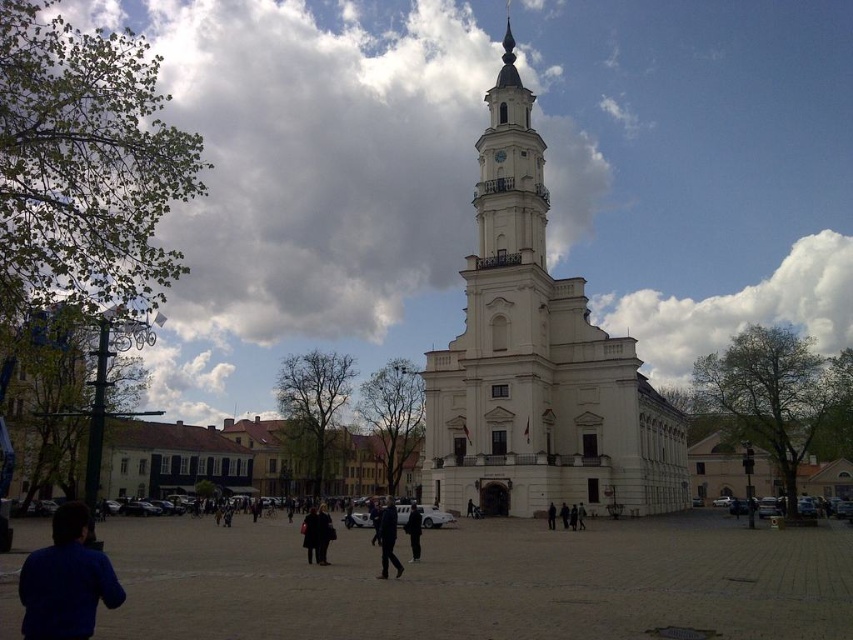
Question: Which point is closer to the camera?

Choices:
 (A) click(73, 602)
 (B) click(415, 560)
 (C) click(321, 516)
 (D) click(312, 544)

Answer: (A)

Question: Which is farther from the white stone clock tower at center?

Choices:
 (A) dark blue coat at center
 (B) dark blue jacket at center
 (C) blue fabric jacket at lower left
 (D) dark gray fabric jacket at center

Answer: (C)

Question: Is dark brown leather jacket at center thinner than dark gray fabric jacket at center?

Choices:
 (A) no
 (B) yes

Answer: (A)

Question: Is white stone clock tower at center above dark brown leather jacket at center?

Choices:
 (A) no
 (B) yes

Answer: (B)

Question: Which point is closer to the camera?

Choices:
 (A) (387, 516)
 (B) (410, 516)
 (C) (548, 525)

Answer: (A)

Question: In this image, where is dark blue jeans at center located relative to dark gray fabric jacket at center?

Choices:
 (A) below
 (B) above

Answer: (A)